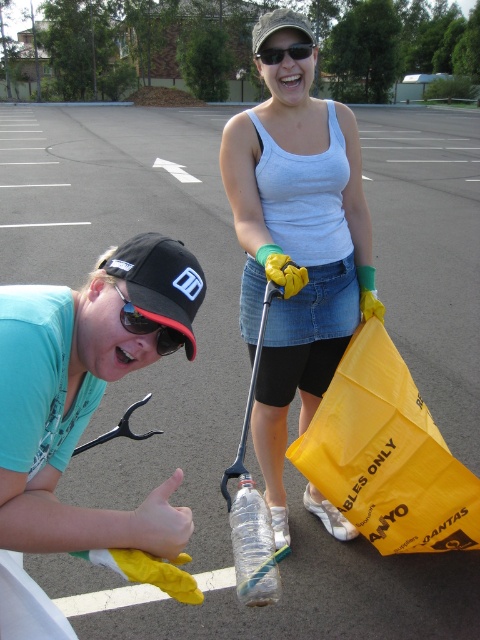
What do you see at coordinates (296, 250) in the screenshot? This screenshot has width=480, height=640. I see `denim skirt at center` at bounding box center [296, 250].

Is denim skirt at center behind matte black goggles at upper center?

No, it is not.

Which is behind, point (336, 355) or point (308, 51)?

Positioned behind is point (336, 355).

I want to click on denim skirt at center, so click(x=296, y=250).

Which is above, black fabric baseball cap at left or matte black goggles at upper center?

matte black goggles at upper center is higher up.

Is point (127, 284) more distant than point (263, 61)?

No, it is in front of (263, 61).

The width and height of the screenshot is (480, 640). In order to click on black fabric baseball cap at left in this screenshot , I will do click(160, 280).

Is black fabric baseball cap at left smaller than transparent plastic bottle at center?

Incorrect, black fabric baseball cap at left is not smaller in size than transparent plastic bottle at center.

In order to click on black fabric baseball cap at left in this screenshot , I will do `click(160, 280)`.